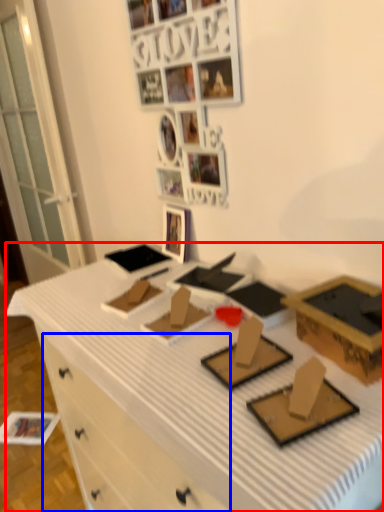
Question: Among these objects, which one is nearest to the camera, desk (highlighted by a red box) or drawer (highlighted by a blue box)?

Choices:
 (A) desk
 (B) drawer

Answer: (A)